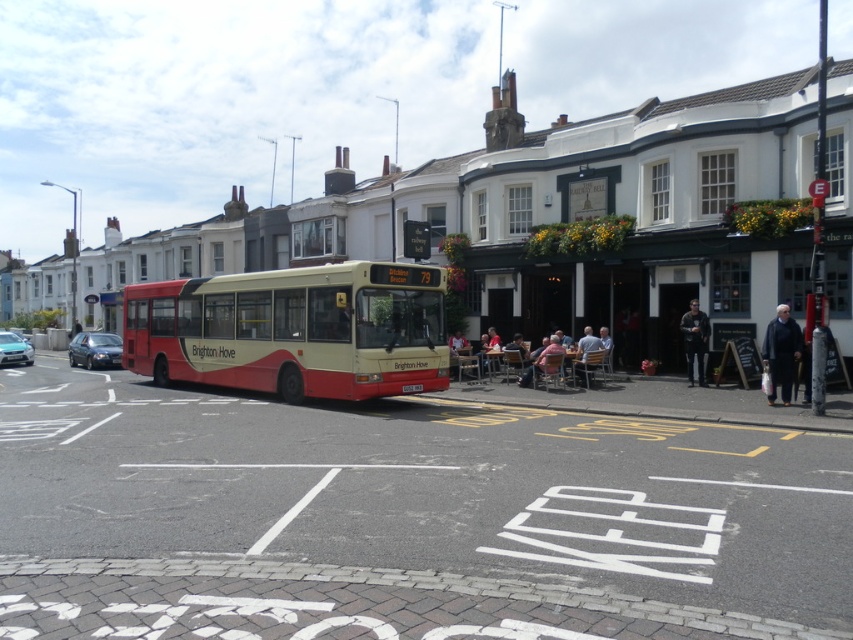
You are a passerby on the street and see both the dark gray wool coat at lower right and the dark gray jacket at center. Which clothing item is shorter in height?

The dark gray wool coat at lower right is shorter than the dark gray jacket at center.